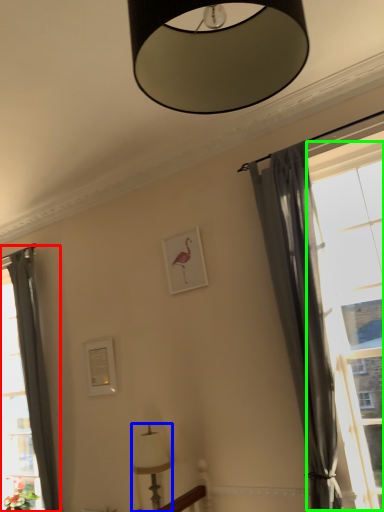
Question: Which is farther away from curtain (highlighted by a red box)? lamp (highlighted by a blue box) or window (highlighted by a green box)?

Choices:
 (A) lamp
 (B) window

Answer: (B)